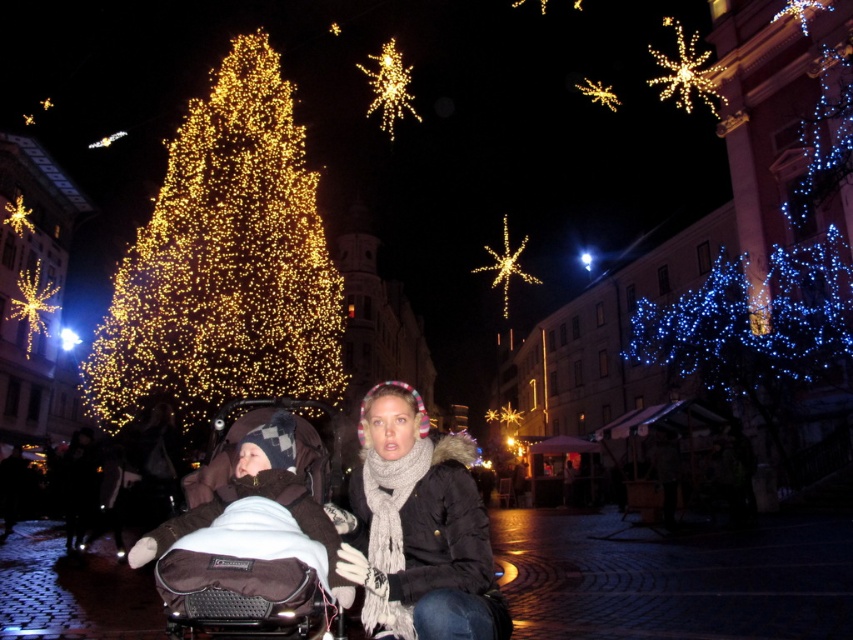
Between point (123, 285) and point (674, 70), which one is positioned behind?

Positioned behind is point (674, 70).

Can you confirm if illuminated gold lights at left is wider than illuminated star at upper right?

No, illuminated gold lights at left is not wider than illuminated star at upper right.

The image size is (853, 640). Describe the element at coordinates (224, 262) in the screenshot. I see `illuminated gold lights at left` at that location.

Where is `illuminated gold lights at left`? The width and height of the screenshot is (853, 640). illuminated gold lights at left is located at coordinates (224, 262).

Is brown fabric baby carriage at lower left smaller than illuminated star at upper right?

Yes, brown fabric baby carriage at lower left is smaller than illuminated star at upper right.

Is brown fabric baby carriage at lower left positioned at the back of illuminated star at upper right?

No, it is not.

Is point (263, 468) positioned behind point (654, 52)?

No.

The image size is (853, 640). Identify the location of brown fabric baby carriage at lower left. (250, 560).

Is brown fabric baby carriage at lower left closer to camera compared to iridescent metallic starburst at upper center?

Yes.

Does brown fabric baby carriage at lower left have a smaller size compared to iridescent metallic starburst at upper center?

Correct, brown fabric baby carriage at lower left occupies less space than iridescent metallic starburst at upper center.

Where is `brown fabric baby carriage at lower left`? brown fabric baby carriage at lower left is located at coordinates (250, 560).

At what (x,y) coordinates should I click in order to perform the action: click on brown fabric baby carriage at lower left. Please return your answer as a coordinate pair (x, y). This screenshot has width=853, height=640. Looking at the image, I should click on (250, 560).